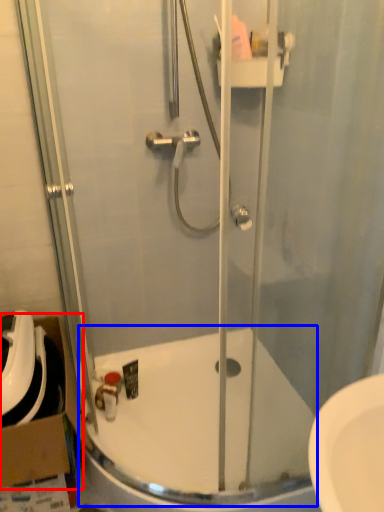
Question: Which object appears closest to the camera in this image, cardboard box (highlighted by a red box) or bath (highlighted by a blue box)?

Choices:
 (A) cardboard box
 (B) bath

Answer: (B)